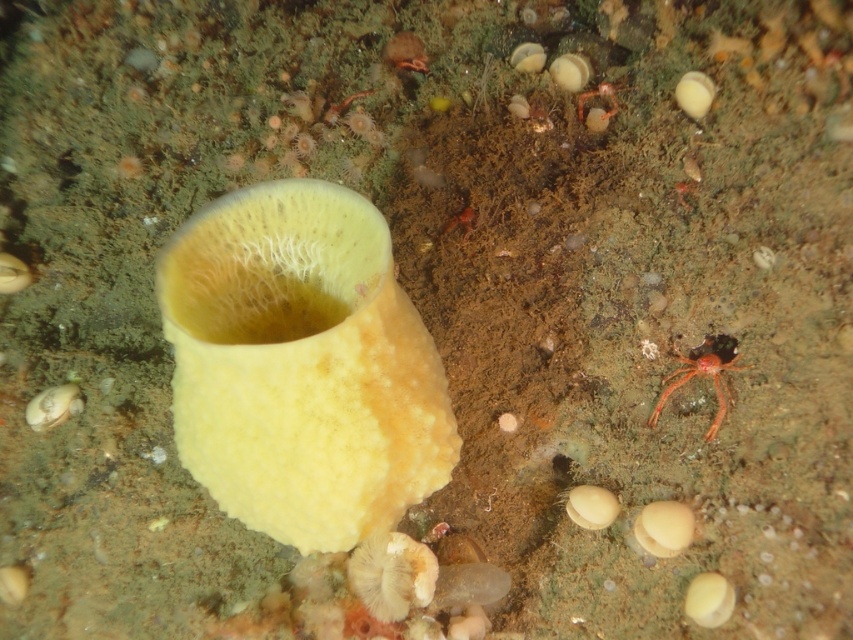
In the scene shown: Who is shorter, translucent orange spider at lower right or translucent orange crab at upper center?

With less height is translucent orange crab at upper center.

Can you confirm if translucent orange spider at lower right is positioned to the right of translucent orange crab at upper center?

Yes, translucent orange spider at lower right is to the right of translucent orange crab at upper center.

Between point (723, 362) and point (608, 106), which one is positioned in front?

Point (723, 362) is in front.

Identify the location of translucent orange spider at lower right. The width and height of the screenshot is (853, 640). (704, 374).